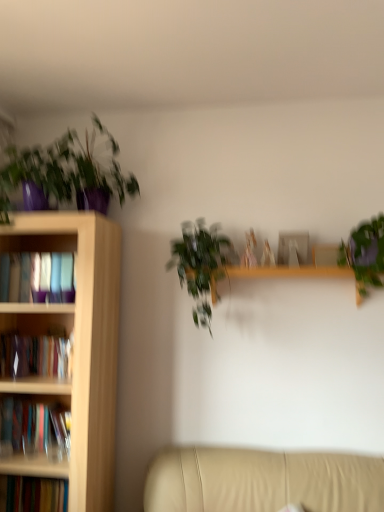
Question: Does matte purple pot at upper left, which is counted as the third houseplant, starting from the right, have a greater width compared to green matte plant at upper right, the first houseplant viewed from the right?

Choices:
 (A) no
 (B) yes

Answer: (B)

Question: Is matte purple pot at upper left, which is counted as the third houseplant, starting from the right, to the right of green matte plant at upper right, which is counted as the fourth houseplant, starting from the left, from the viewer's perspective?

Choices:
 (A) no
 (B) yes

Answer: (A)

Question: From a real-world perspective, does matte purple pot at upper left, which is the 2th houseplant from left to right, sit lower than green matte plant at upper right, the first houseplant viewed from the right?

Choices:
 (A) no
 (B) yes

Answer: (A)

Question: Can you confirm if matte purple pot at upper left, which is counted as the third houseplant, starting from the right, is taller than green matte plant at upper right, the first houseplant viewed from the right?

Choices:
 (A) no
 (B) yes

Answer: (B)

Question: Is matte purple pot at upper left, which is counted as the third houseplant, starting from the right, looking in the opposite direction of green matte plant at upper right, which is counted as the fourth houseplant, starting from the left?

Choices:
 (A) no
 (B) yes

Answer: (A)

Question: Is the depth of matte purple pot at upper left, which is counted as the third houseplant, starting from the right, greater than that of green matte plant at upper right, which is counted as the fourth houseplant, starting from the left?

Choices:
 (A) no
 (B) yes

Answer: (A)

Question: Is wooden bookcase at left at the left side of green matte plant at upper right, the first houseplant viewed from the right?

Choices:
 (A) no
 (B) yes

Answer: (B)

Question: Can you confirm if wooden bookcase at left is thinner than green matte plant at upper right, which is counted as the fourth houseplant, starting from the left?

Choices:
 (A) yes
 (B) no

Answer: (B)

Question: Considering the relative sizes of wooden bookcase at left and green matte plant at upper right, which is counted as the fourth houseplant, starting from the left, in the image provided, is wooden bookcase at left shorter than green matte plant at upper right, which is counted as the fourth houseplant, starting from the left,?

Choices:
 (A) yes
 (B) no

Answer: (B)

Question: From a real-world perspective, is wooden bookcase at left physically above green matte plant at upper right, the first houseplant viewed from the right?

Choices:
 (A) no
 (B) yes

Answer: (A)

Question: From a real-world perspective, is wooden bookcase at left located beneath green matte plant at upper right, which is counted as the fourth houseplant, starting from the left?

Choices:
 (A) no
 (B) yes

Answer: (B)

Question: Does wooden bookcase at left touch green matte plant at upper right, the first houseplant viewed from the right?

Choices:
 (A) no
 (B) yes

Answer: (A)

Question: From the image's perspective, would you say green leafy plant at center, which ranks as the second houseplant in right-to-left order, is shown under beige leather couch at lower right?

Choices:
 (A) no
 (B) yes

Answer: (A)